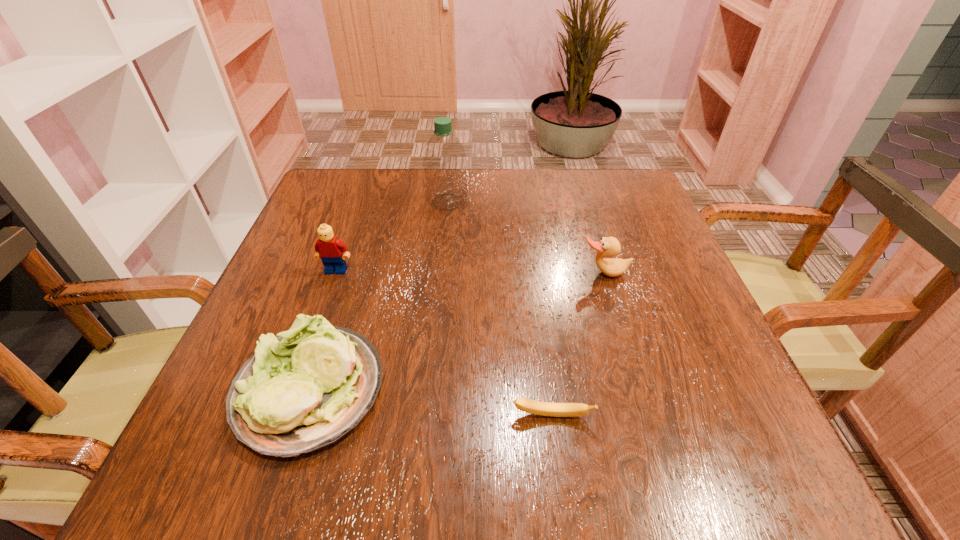
Where is `empty space that is in between the rightmost object and the fourth shortest object`? This screenshot has width=960, height=540. empty space that is in between the rightmost object and the fourth shortest object is located at coordinates (470, 272).

Where is `free space between the second tallest object and the rightmost object`? Image resolution: width=960 pixels, height=540 pixels. free space between the second tallest object and the rightmost object is located at coordinates (470, 272).

Image resolution: width=960 pixels, height=540 pixels. In order to click on free space that is in between the lettuce and the rightmost object in this screenshot , I will do `click(457, 332)`.

At what (x,y) coordinates should I click in order to perform the action: click on the second closest object to the lettuce. Please return your answer as a coordinate pair (x, y). The width and height of the screenshot is (960, 540). Looking at the image, I should click on (526, 405).

Choose which object is the nearest neighbor to the second object from right to left. Please provide its 2D coordinates. Your answer should be formatted as a tuple, i.e. [(x, y)], where the tuple contains the x and y coordinates of a point satisfying the conditions above.

[(304, 389)]

This screenshot has height=540, width=960. Find the location of `free space that satisfies the following two spatial constraints: 1. on the front-facing side of the second tallest object; 2. on the left side of the lettuce`. free space that satisfies the following two spatial constraints: 1. on the front-facing side of the second tallest object; 2. on the left side of the lettuce is located at coordinates (294, 391).